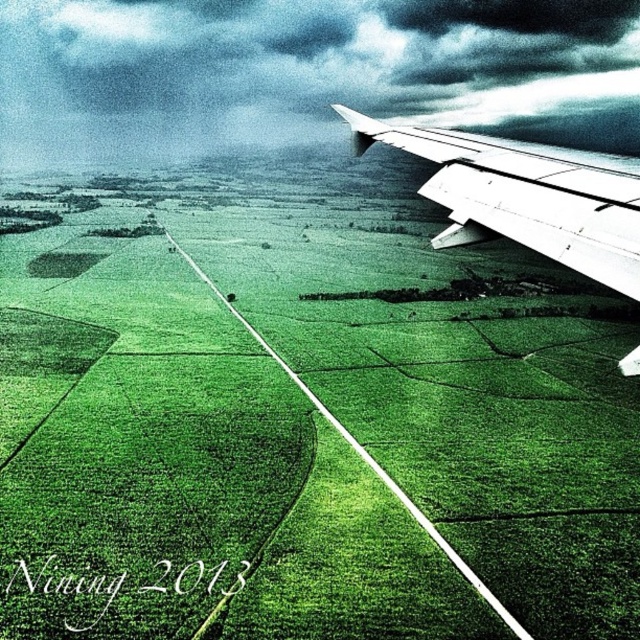
Is point (84, 259) positioned behind point (348, 122)?

Yes, it is behind point (348, 122).

Is point (260, 426) positioned before point (625, 371)?

No.

Find the location of a particular element. green grassy field at upper center is located at coordinates (305, 420).

Does green grassy field at upper center have a greater height compared to dark gray textured cloud at upper center?

Indeed, green grassy field at upper center has a greater height compared to dark gray textured cloud at upper center.

You are a GUI agent. You are given a task and a screenshot of the screen. Output one action in this format:
    pyautogui.click(x=<x>, y=<y>)
    Task: Click on the green grassy field at upper center
    The image size is (640, 640).
    Given the screenshot: What is the action you would take?
    pyautogui.click(x=305, y=420)

Is point (177, 628) positioned in front of point (460, 35)?

Yes, it is.

The width and height of the screenshot is (640, 640). In order to click on green grassy field at upper center in this screenshot , I will do `click(305, 420)`.

Is point (230, 104) closer to camera compared to point (595, 262)?

No, (230, 104) is further to viewer.

Is dark gray textured cloud at upper center further to camera compared to white matte wing at upper right?

Yes.

Is point (205, 90) positioned after point (516, 147)?

Yes, it is.

What are the coordinates of `dark gray textured cloud at upper center` in the screenshot? It's located at (307, 72).